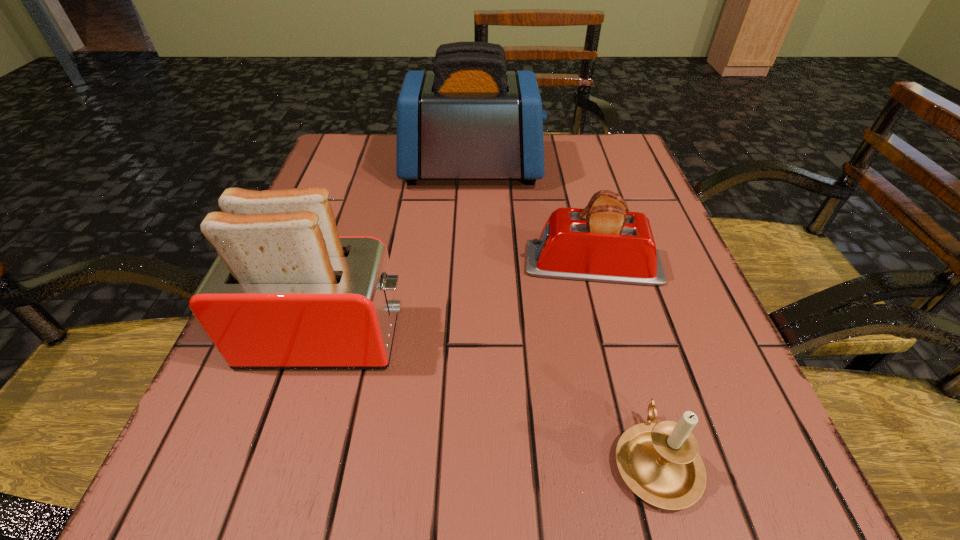
Where is `vacant space that is in between the second nearest object and the farthest toaster`? The height and width of the screenshot is (540, 960). vacant space that is in between the second nearest object and the farthest toaster is located at coordinates [x=399, y=254].

This screenshot has height=540, width=960. I want to click on free space between the farthest toaster and the nearest toaster, so click(x=399, y=254).

The height and width of the screenshot is (540, 960). Identify the location of free space between the candle holder and the farthest object. (564, 314).

Identify the location of the second closest object to the nearest toaster. (660, 463).

Locate which object is the second closest to the shortest toaster. Please provide its 2D coordinates. Your answer should be formatted as a tuple, i.e. [(x, y)], where the tuple contains the x and y coordinates of a point satisfying the conditions above.

[(285, 291)]

What are the coordinates of `the second closest toaster to the farthest object` in the screenshot? It's located at (285, 291).

Locate an element on the screen. toaster that stands as the second closest to the farthest object is located at coordinates (285, 291).

This screenshot has height=540, width=960. Identify the location of free space that satisfies the following two spatial constraints: 1. on the back side of the third nearest object; 2. on the front-facing side of the farthest toaster. (568, 169).

The width and height of the screenshot is (960, 540). I want to click on vacant area that satisfies the following two spatial constraints: 1. on the front-facing side of the farthest toaster; 2. with a handle on the side of the nearest object, so click(x=465, y=460).

At what (x,y) coordinates should I click in order to perform the action: click on vacant region that satisfies the following two spatial constraints: 1. on the front-facing side of the farthest object; 2. on the back side of the second farthest toaster. Please return your answer as a coordinate pair (x, y). Looking at the image, I should click on (469, 264).